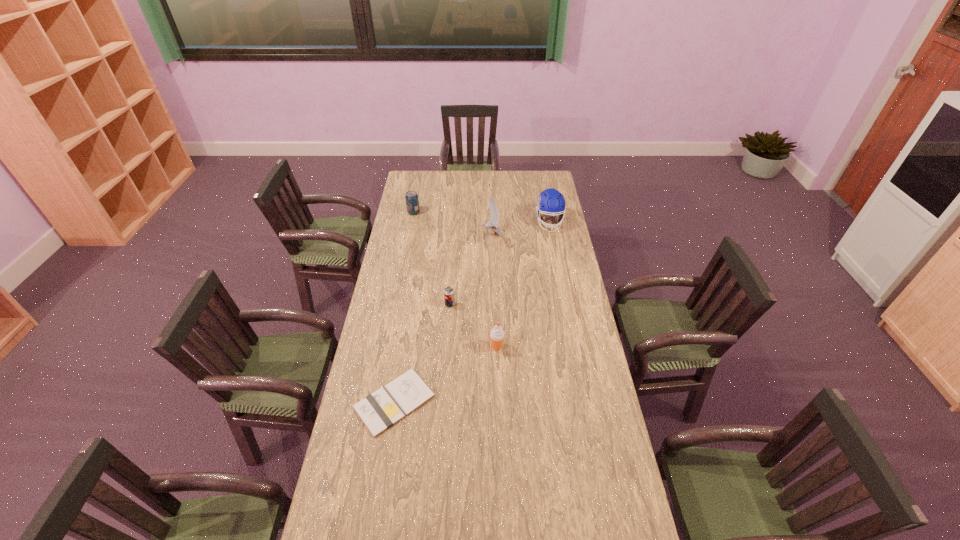
In the image, there is a desktop. Identify the location of vacant space at the left edge. pos(348,466).

Identify the location of vacant space at the right edge of the desktop. This screenshot has height=540, width=960. (607, 467).

The image size is (960, 540). What are the coordinates of `free space that is in between the third object from left to right and the gull` in the screenshot? It's located at (470, 270).

Where is `free point between the gull and the rightmost object`? Image resolution: width=960 pixels, height=540 pixels. free point between the gull and the rightmost object is located at coordinates (520, 229).

The width and height of the screenshot is (960, 540). Identify the location of vacant space that is in between the football helmet and the fourth object from right to left. click(x=499, y=264).

Find the location of a particular element. This screenshot has width=960, height=540. unoccupied area between the second shortest object and the shortest object is located at coordinates (422, 353).

Identify the location of free spot between the rightmost object and the icecream. (523, 285).

In order to click on unoccupied position between the icecream and the third nearest object in this screenshot , I will do `click(473, 326)`.

Find the location of a particular element. The height and width of the screenshot is (540, 960). free point between the fifth farthest object and the third nearest object is located at coordinates (473, 326).

Identify the location of vacant region between the gull and the icecream. (494, 291).